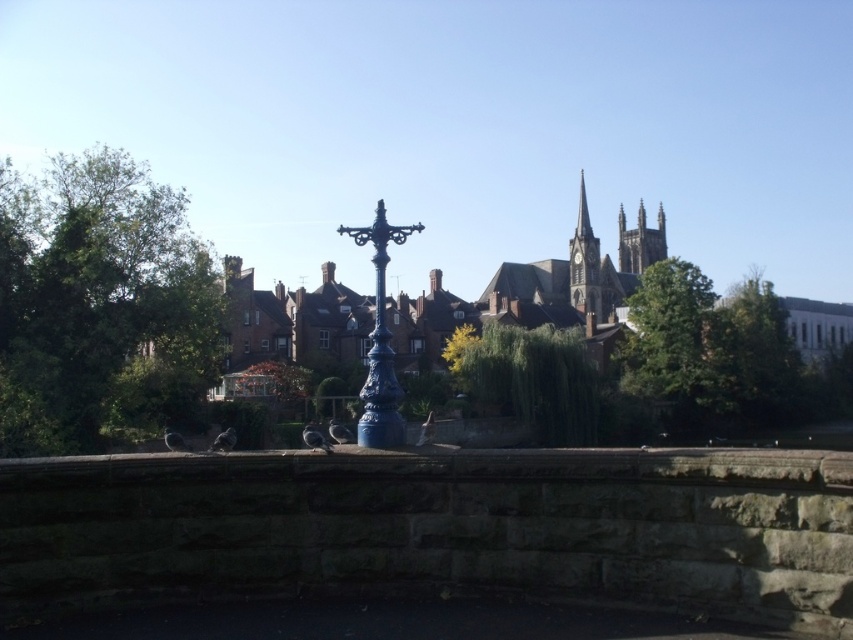
Question: Which point is farther to the camera?

Choices:
 (A) (286, 388)
 (B) (572, 236)
 (C) (209, 259)

Answer: (B)

Question: Can you confirm if green leafy tree at center is positioned to the right of smooth stone tower at upper right?

Choices:
 (A) yes
 (B) no

Answer: (B)

Question: Among these points, which one is nearest to the camera?

Choices:
 (A) (664, 237)
 (B) (294, 392)
 (C) (376, 218)
 (D) (585, 205)

Answer: (C)

Question: Which object is the closest to the blue cast iron lamp post at center?

Choices:
 (A) green leafy tree at left
 (B) smooth stone spire at upper right
 (C) orange leafy tree at center
 (D) green leafy tree at center

Answer: (C)

Question: Is green leafy tree at left smaller than green leafy tree at right?

Choices:
 (A) no
 (B) yes

Answer: (A)

Question: Does green leafy tree at center appear on the left side of blue cast iron lamp post at center?

Choices:
 (A) no
 (B) yes

Answer: (A)